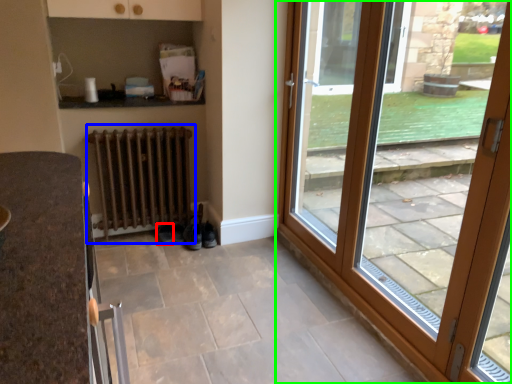
Question: Which object is positioned closest to shoe (highlighted by a red box)? Select from radiator (highlighted by a blue box) and door (highlighted by a green box).

Choices:
 (A) radiator
 (B) door

Answer: (A)